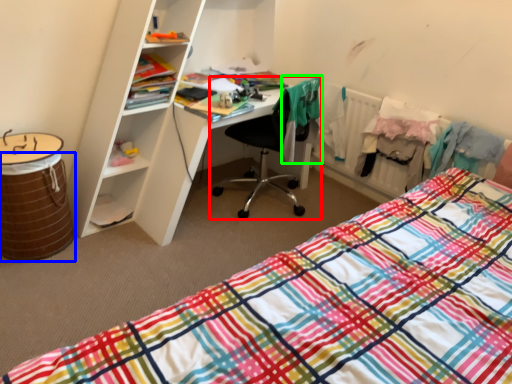
Question: Which is nearer to the chair (highlighted by a red box)? barrel (highlighted by a blue box) or clothing (highlighted by a green box).

Choices:
 (A) barrel
 (B) clothing

Answer: (B)